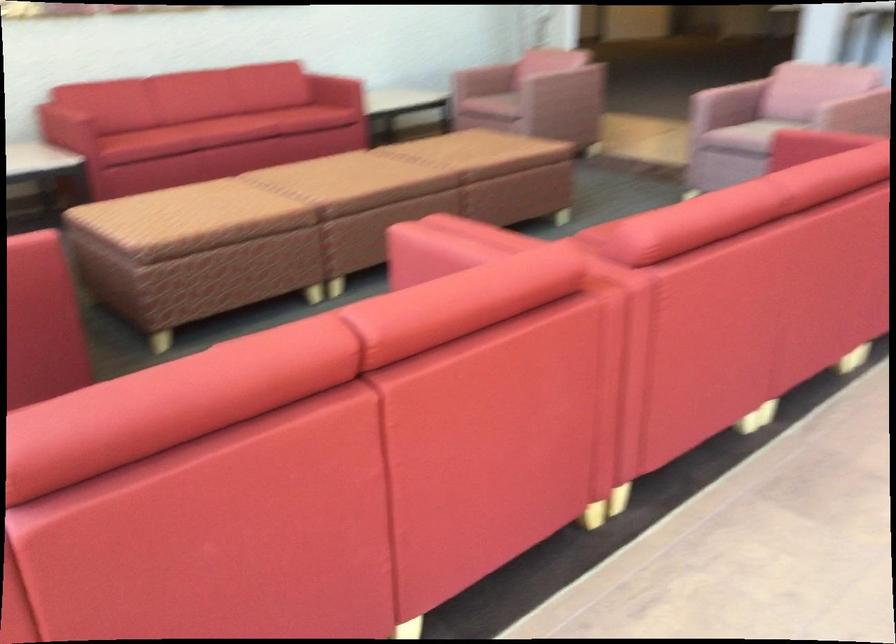
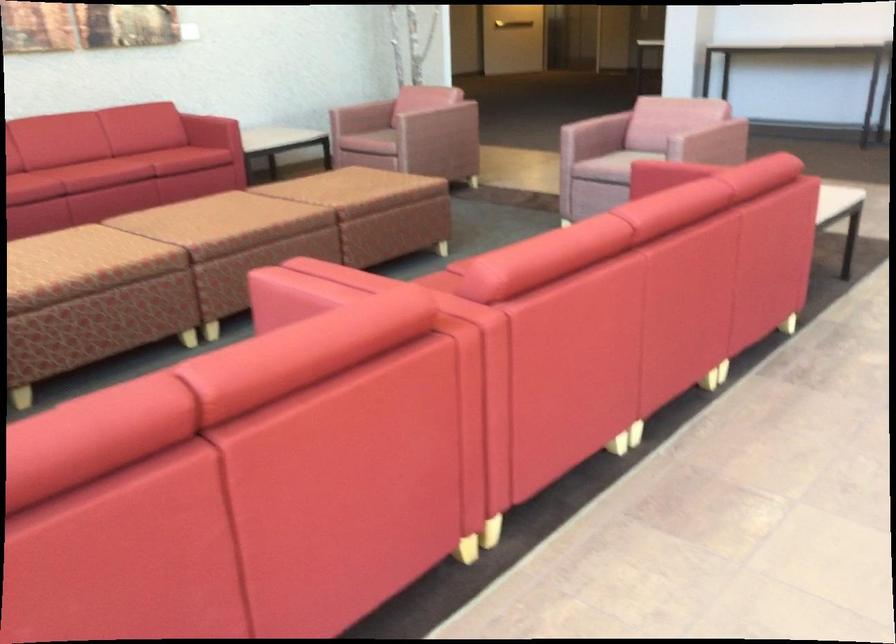
In the second image, find the point that corresponds to (x=381, y=192) in the first image.

(254, 234)